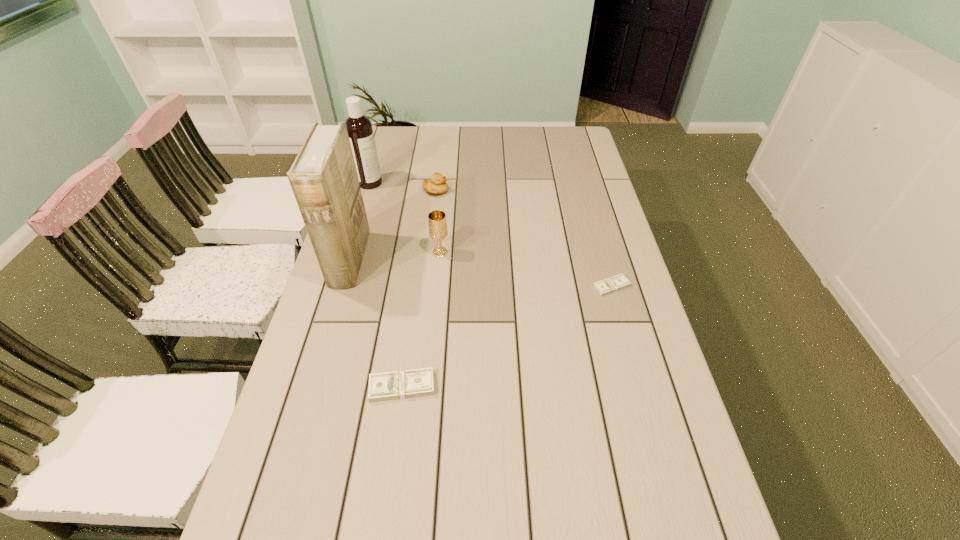
If equal spacing is the goal by inserting an additional money among them, please point out a vacant space for this new money. Please provide its 2D coordinates. Your answer should be formatted as a tuple, i.e. [(x, y)], where the tuple contains the x and y coordinates of a point satisfying the conditions above.

[(516, 332)]